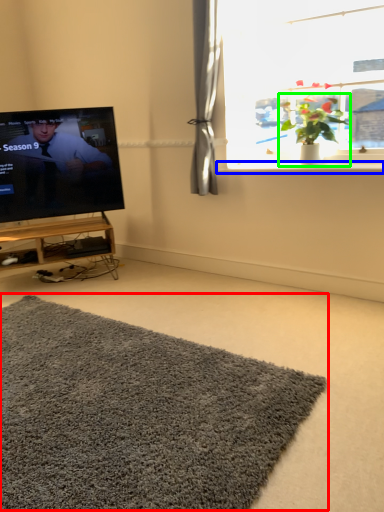
Question: Which is farther away from doormat (highlighted by a red box)? window sill (highlighted by a blue box) or houseplant (highlighted by a green box)?

Choices:
 (A) window sill
 (B) houseplant

Answer: (B)